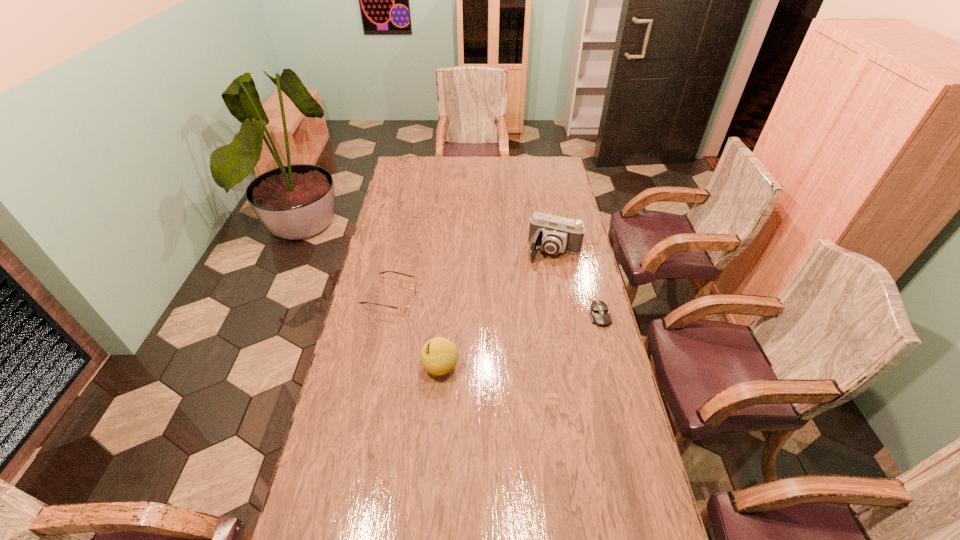
Identify the location of vacant space that is in between the camera and the shortest object. (577, 283).

The width and height of the screenshot is (960, 540). I want to click on vacant area that lies between the computer mouse and the tallest object, so click(x=577, y=283).

The width and height of the screenshot is (960, 540). I want to click on free spot between the nearest object and the shortest object, so click(520, 341).

You are a GUI agent. You are given a task and a screenshot of the screen. Output one action in this format:
    pyautogui.click(x=<x>, y=<y>)
    Task: Click on the free space that is in between the softball and the tallest object
    The height and width of the screenshot is (540, 960).
    Given the screenshot: What is the action you would take?
    pyautogui.click(x=497, y=309)

The height and width of the screenshot is (540, 960). What are the coordinates of `free space between the leftmost object and the farthest object` in the screenshot? It's located at (472, 274).

Image resolution: width=960 pixels, height=540 pixels. I want to click on the third closest object to the spectacles, so click(x=599, y=314).

The image size is (960, 540). I want to click on the third closest object to the spectacles, so click(599, 314).

The width and height of the screenshot is (960, 540). Identify the location of free point that satisfies the following two spatial constraints: 1. on the front side of the spectacles; 2. on the logo side of the second tallest object. (376, 367).

Where is `vacant space that satisfies the following two spatial constraints: 1. on the front side of the third shortest object; 2. on the logo side of the spectacles`? vacant space that satisfies the following two spatial constraints: 1. on the front side of the third shortest object; 2. on the logo side of the spectacles is located at coordinates (376, 367).

Identify the location of vacant space that satisfies the following two spatial constraints: 1. on the front side of the third object from right to left; 2. on the logo side of the leftmost object. (376, 367).